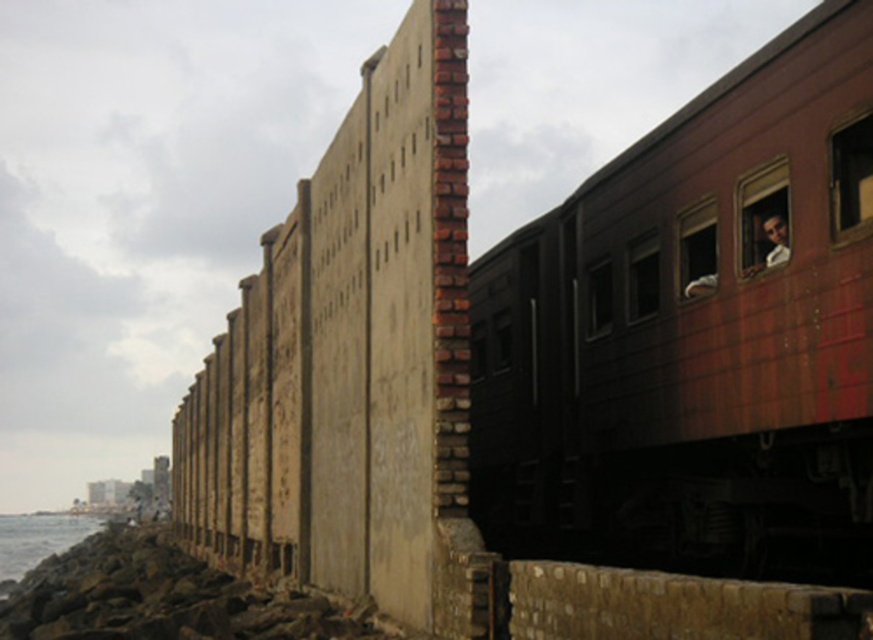
Question: From the image, what is the correct spatial relationship of rusty metal train at right in relation to gray rocky water at lower left?

Choices:
 (A) right
 (B) left

Answer: (A)

Question: Observing the image, what is the correct spatial positioning of rusty metal train at right in reference to gray rocky water at lower left?

Choices:
 (A) right
 (B) left

Answer: (A)

Question: Which point is farther to the camera?

Choices:
 (A) (5, 611)
 (B) (849, 417)

Answer: (A)

Question: Which of the following is the farthest from the observer?

Choices:
 (A) gray rocky water at lower left
 (B) rusty metal train at right

Answer: (A)

Question: Considering the relative positions of rusty metal train at right and gray rocky water at lower left in the image provided, where is rusty metal train at right located with respect to gray rocky water at lower left?

Choices:
 (A) left
 (B) right

Answer: (B)

Question: Which point is farther to the camera?

Choices:
 (A) rusty metal train at right
 (B) gray rocky water at lower left

Answer: (B)